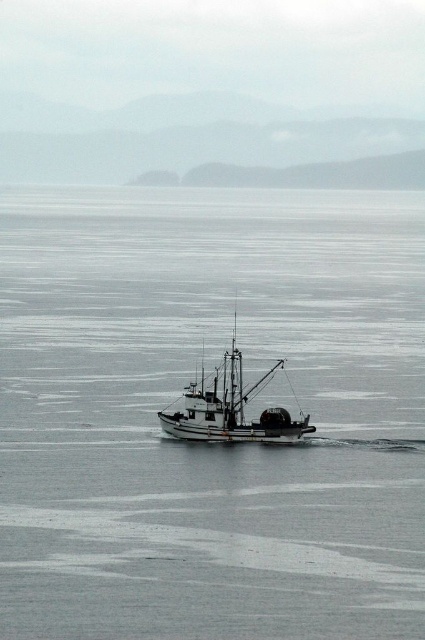
You are standing on a dock and see the gray matte water at center in front of you. If you want to throw a small pebble into the water, will it land within 40 meters from your current position?

The gray matte water at center is 38.69 meters away from the camera, so yes, the pebble will land within 40 meters from your current position.

You are a photographer trying to capture the white matte fishing boat at center in your shot. Since the gray matte water at center takes up most of the frame, how does the boat compare in size to the water in the image?

The gray matte water at center has a larger size compared to the white matte fishing boat at center, so the boat appears smaller in the image.